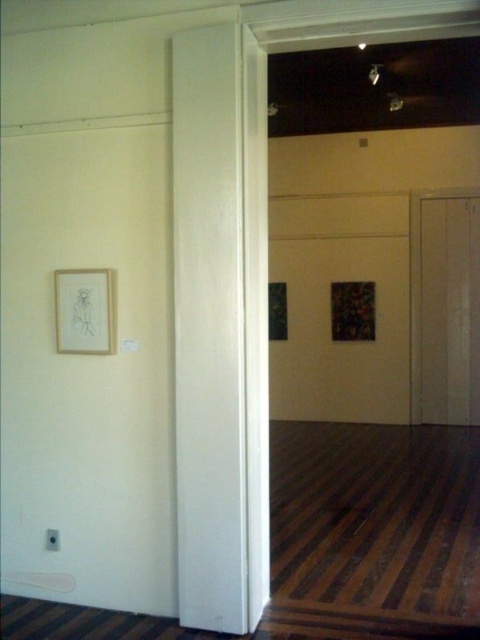
Between white glossy door at center and white matte door at right, which one has less height?

Standing shorter between the two is white matte door at right.

Which is behind, point (206, 176) or point (468, 212)?

The point (468, 212) is more distant.

Is point (197, 547) less distant than point (455, 259)?

Yes, point (197, 547) is closer to viewer.

In order to click on white glossy door at center in this screenshot , I will do `click(210, 328)`.

Is white glossy door at center taller than matte wooden picture frame at left?

Indeed, white glossy door at center has a greater height compared to matte wooden picture frame at left.

This screenshot has width=480, height=640. Identify the location of white glossy door at center. (210, 328).

This screenshot has width=480, height=640. I want to click on white glossy door at center, so click(210, 328).

Which is below, white matte door at right or matte wooden picture frame at left?

Positioned lower is matte wooden picture frame at left.

Does point (455, 308) come behind point (101, 339)?

Yes, it is.

Is point (448, 294) farther from camera compared to point (99, 349)?

Yes, it is.

Locate an element on the screen. white matte door at right is located at coordinates (450, 308).